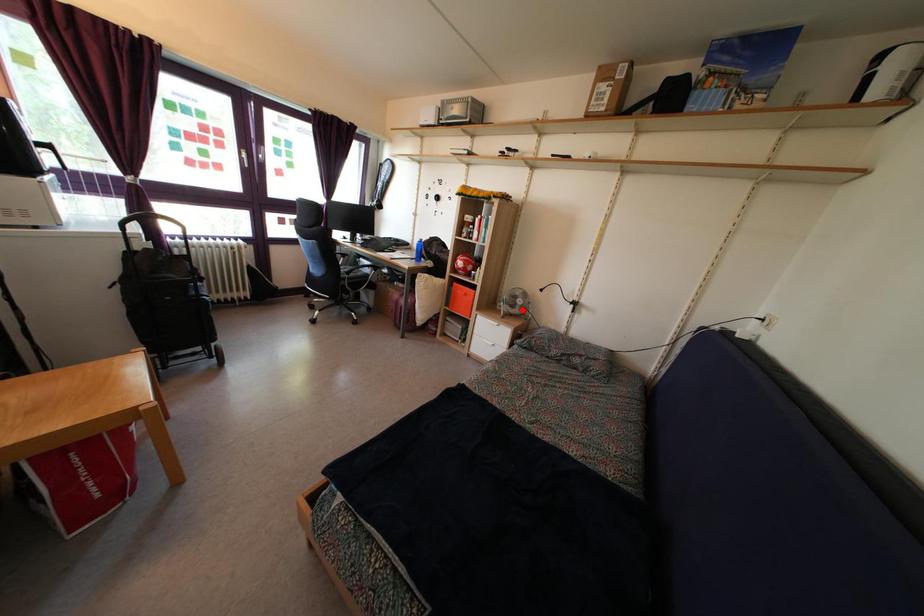
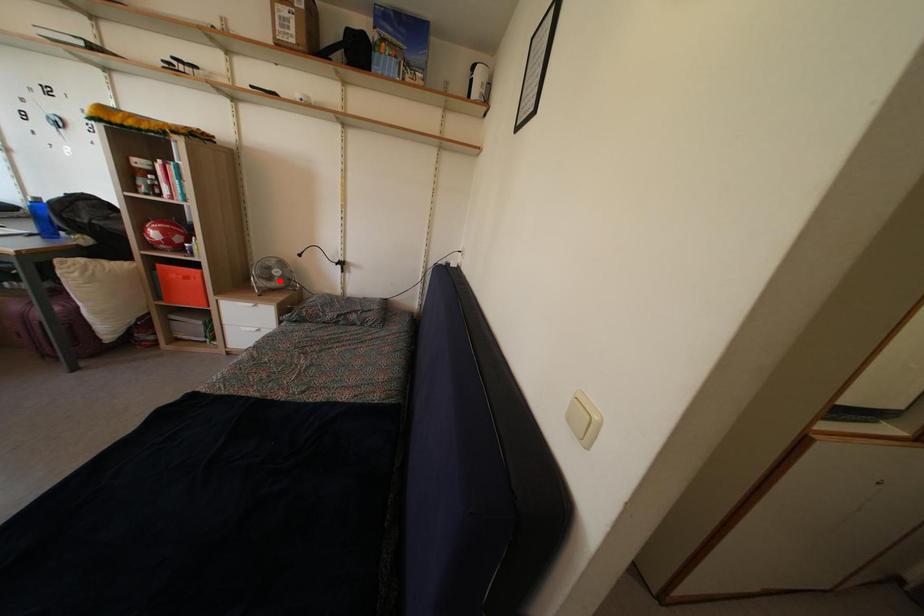
From the picture: I am providing you with two images of the same scene from different viewpoints. A red point is marked on the first image and another point is marked on the second image. Is the red point in image1 aligned with the point shown in image2?

Yes